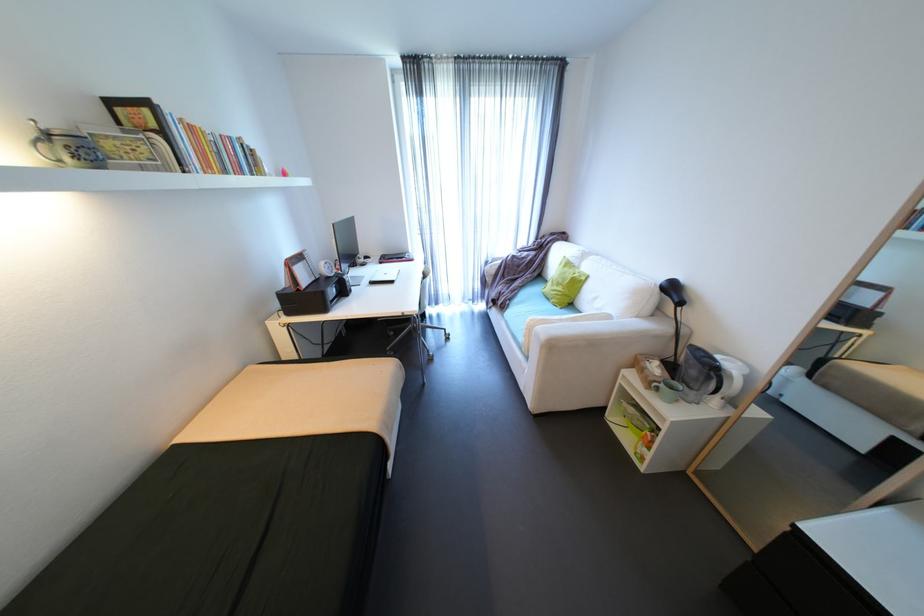
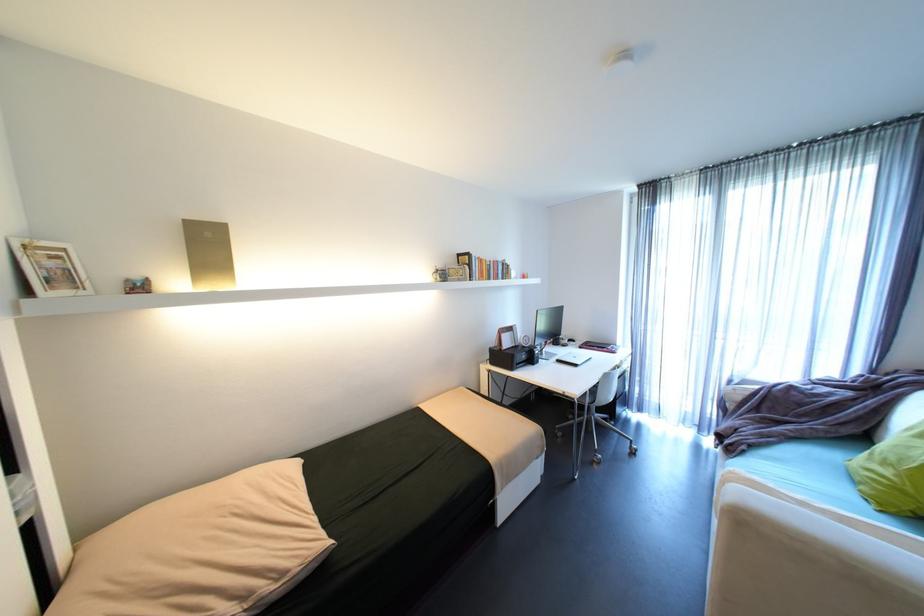
Find the pixel in the second image that matches the point at 570,289 in the first image.

(906, 476)